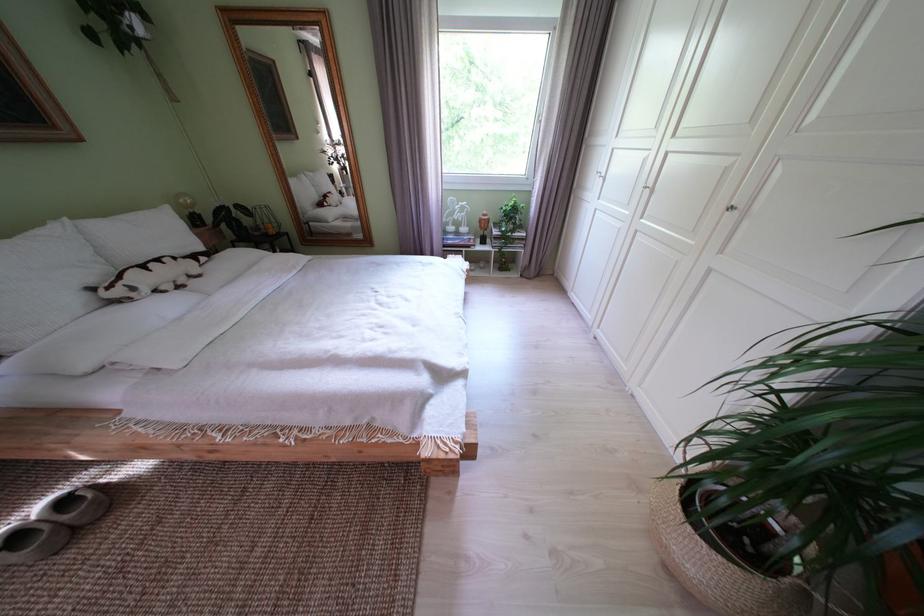
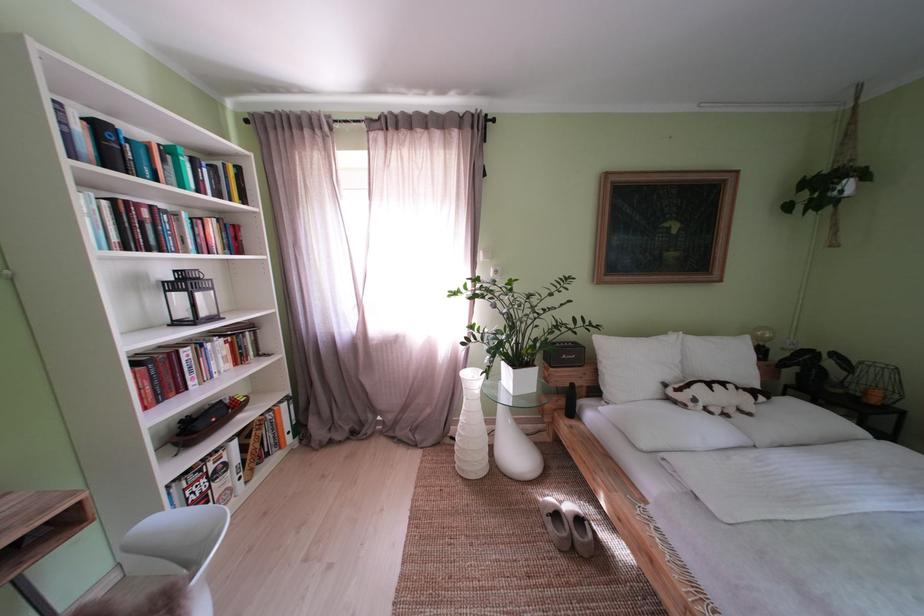
Question: The camera is either moving clockwise (left) or counter-clockwise (right) around the object. The first image is from the beginning of the video and the second image is from the end. Is the camera moving left or right when shooting the video?

Choices:
 (A) Left
 (B) Right

Answer: (B)